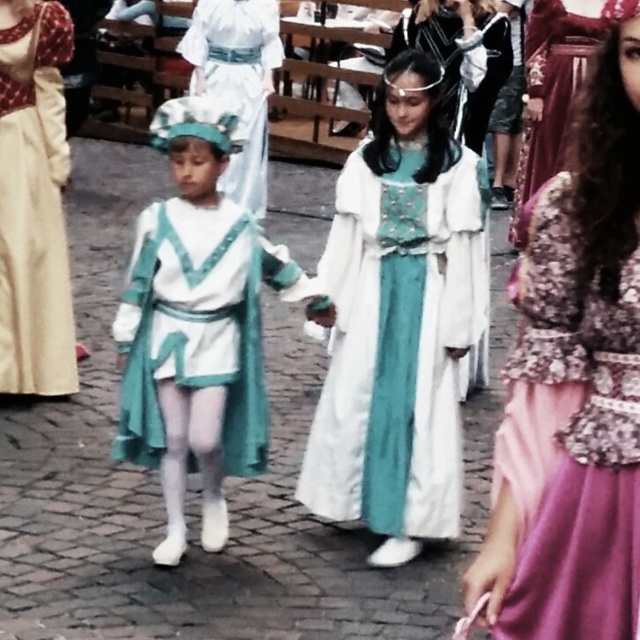
You are a photographer standing at the edge of the courtyard where the matte white costume at center and the teal satin dress at center are positioned. You want to take a photo that includes both subjects without moving them. Given that your camera has a maximum focus range of 5 meters, will you be able to capture both in focus?

The distance between the matte white costume at center and the teal satin dress at center is 5.18 meters. Since the camera can only focus up to 5 meters, the subjects are slightly out of the focus range. Therefore, you won

From the picture: You are a photographer setting up for a group photo. You notice the teal satin dress at center and the velvet maroon dress at right. Which dress is covering part of the other?

The teal satin dress at center is positioned over the velvet maroon dress at right, so it is covering part of it.